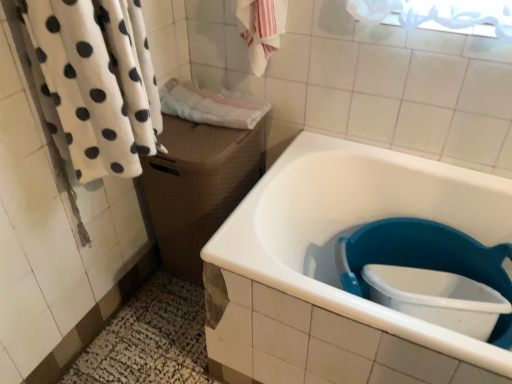
Where is `brown woven box at center`? Image resolution: width=512 pixels, height=384 pixels. brown woven box at center is located at coordinates (198, 186).

What do you see at coordinates (261, 29) in the screenshot? I see `white striped fabric at upper center, acting as the 2th bath towel starting from the back` at bounding box center [261, 29].

Image resolution: width=512 pixels, height=384 pixels. What do you see at coordinates (96, 83) in the screenshot?
I see `white fluffy towel at left, arranged as the 3th bath towel when viewed from the back` at bounding box center [96, 83].

Identify the location of pink terry cloth towel at center, marked as the first bath towel in a back-to-front arrangement. The width and height of the screenshot is (512, 384). (211, 105).

Find the location of `brown woven box at center`. brown woven box at center is located at coordinates (198, 186).

Choose the correct answer: Is brown woven box at center inside white striped fabric at upper center, acting as the 2th bath towel starting from the back, or outside it?

The correct answer is: outside.

Is point (199, 186) closer to viewer compared to point (272, 17)?

That is False.

Is brown woven box at center far from white striped fabric at upper center, acting as the 2th bath towel starting from the back?

No.

From the picture: From the image's perspective, between brown woven box at center and white striped fabric at upper center, acting as the 2th bath towel starting from the back, who is located below?

brown woven box at center is shown below in the image.

Between white fluffy towel at left, which appears as the 1th bath towel when viewed from the front, and pink terry cloth towel at center, marked as the first bath towel in a back-to-front arrangement, which one has smaller size?

pink terry cloth towel at center, marked as the first bath towel in a back-to-front arrangement.

Would you say white fluffy towel at left, which appears as the 1th bath towel when viewed from the front, is inside or outside pink terry cloth towel at center, marked as the first bath towel in a back-to-front arrangement?

white fluffy towel at left, which appears as the 1th bath towel when viewed from the front, lies outside pink terry cloth towel at center, marked as the first bath towel in a back-to-front arrangement.

Based on the photo, measure the distance from white fluffy towel at left, arranged as the 3th bath towel when viewed from the back, to pink terry cloth towel at center, the third bath towel in the front-to-back sequence.

15.48 inches.

Is white fluffy towel at left, arranged as the 3th bath towel when viewed from the back, wider or thinner than pink terry cloth towel at center, the third bath towel in the front-to-back sequence?

Considering their sizes, white fluffy towel at left, arranged as the 3th bath towel when viewed from the back, looks slimmer than pink terry cloth towel at center, the third bath towel in the front-to-back sequence.

From the image's perspective, is white fluffy towel at left, arranged as the 3th bath towel when viewed from the back, located above or below white glossy bathtub at lower right?

white fluffy towel at left, arranged as the 3th bath towel when viewed from the back, is situated higher than white glossy bathtub at lower right in the image.

Is white fluffy towel at left, which appears as the 1th bath towel when viewed from the front, positioned with its back to white glossy bathtub at lower right?

white fluffy towel at left, which appears as the 1th bath towel when viewed from the front, is not turned away from white glossy bathtub at lower right.

Is white fluffy towel at left, arranged as the 3th bath towel when viewed from the back, taller than white glossy bathtub at lower right?

Yes, white fluffy towel at left, arranged as the 3th bath towel when viewed from the back, is taller than white glossy bathtub at lower right.

From a real-world perspective, does white fluffy towel at left, which appears as the 1th bath towel when viewed from the front, sit lower than white glossy bathtub at lower right?

No, from a real-world perspective, white fluffy towel at left, which appears as the 1th bath towel when viewed from the front, is not below white glossy bathtub at lower right.

Which object is positioned more to the left, white glossy bathtub at lower right or white fluffy towel at left, arranged as the 3th bath towel when viewed from the back?

From the viewer's perspective, white fluffy towel at left, arranged as the 3th bath towel when viewed from the back, appears more on the left side.

Is white glossy bathtub at lower right inside the boundaries of white fluffy towel at left, which appears as the 1th bath towel when viewed from the front, or outside?

white glossy bathtub at lower right exists outside the volume of white fluffy towel at left, which appears as the 1th bath towel when viewed from the front.

Is white glossy bathtub at lower right further to camera compared to white fluffy towel at left, which appears as the 1th bath towel when viewed from the front?

Yes, white glossy bathtub at lower right is behind white fluffy towel at left, which appears as the 1th bath towel when viewed from the front.

Can you confirm if white glossy bathtub at lower right is bigger than white fluffy towel at left, arranged as the 3th bath towel when viewed from the back?

Yes.

From the image's perspective, does white fluffy towel at left, which appears as the 1th bath towel when viewed from the front, appear lower than brown woven box at center?

No, from the image's perspective, white fluffy towel at left, which appears as the 1th bath towel when viewed from the front, is not beneath brown woven box at center.

This screenshot has width=512, height=384. I want to click on the 1st bath towel above the brown woven box at center (from the image's perspective), so click(96, 83).

Visually, is white fluffy towel at left, arranged as the 3th bath towel when viewed from the back, positioned to the left or to the right of brown woven box at center?

Clearly, white fluffy towel at left, arranged as the 3th bath towel when viewed from the back, is on the left of brown woven box at center in the image.

Does white glossy bathtub at lower right turn towards white striped fabric at upper center, which is counted as the 2th bath towel, starting from the front?

No, white glossy bathtub at lower right does not turn towards white striped fabric at upper center, which is counted as the 2th bath towel, starting from the front.

Where is `bathtub that is on the right side of white striped fabric at upper center, which is counted as the 2th bath towel, starting from the front`? bathtub that is on the right side of white striped fabric at upper center, which is counted as the 2th bath towel, starting from the front is located at coordinates (336, 270).

Which object is positioned more to the left, white glossy bathtub at lower right or white striped fabric at upper center, which is counted as the 2th bath towel, starting from the front?

Positioned to the left is white striped fabric at upper center, which is counted as the 2th bath towel, starting from the front.

Is white glossy bathtub at lower right directly adjacent to white striped fabric at upper center, which is counted as the 2th bath towel, starting from the front?

No.

Between white striped fabric at upper center, acting as the 2th bath towel starting from the back, and pink terry cloth towel at center, the third bath towel in the front-to-back sequence, which one has smaller width?

With smaller width is white striped fabric at upper center, acting as the 2th bath towel starting from the back.

From the picture: From a real-world perspective, is white striped fabric at upper center, which is counted as the 2th bath towel, starting from the front, physically located above or below pink terry cloth towel at center, the third bath towel in the front-to-back sequence?

In terms of real-world spatial position, white striped fabric at upper center, which is counted as the 2th bath towel, starting from the front, is above pink terry cloth towel at center, the third bath towel in the front-to-back sequence.

Between white striped fabric at upper center, which is counted as the 2th bath towel, starting from the front, and pink terry cloth towel at center, marked as the first bath towel in a back-to-front arrangement, which one has more height?

white striped fabric at upper center, which is counted as the 2th bath towel, starting from the front, is taller.

Is white striped fabric at upper center, acting as the 2th bath towel starting from the back, located outside pink terry cloth towel at center, marked as the first bath towel in a back-to-front arrangement?

That's correct, white striped fabric at upper center, acting as the 2th bath towel starting from the back, is outside of pink terry cloth towel at center, marked as the first bath towel in a back-to-front arrangement.

Where is `box below the white striped fabric at upper center, acting as the 2th bath towel starting from the back (from the image's perspective)`? box below the white striped fabric at upper center, acting as the 2th bath towel starting from the back (from the image's perspective) is located at coordinates (198, 186).

Locate an element on the screen. The height and width of the screenshot is (384, 512). bath towel lying on the left of pink terry cloth towel at center, marked as the first bath towel in a back-to-front arrangement is located at coordinates (96, 83).

Considering their positions, is pink terry cloth towel at center, marked as the first bath towel in a back-to-front arrangement, positioned closer to white glossy bathtub at lower right than brown woven box at center?

brown woven box at center is closer to white glossy bathtub at lower right.

Which object lies further to the anchor point white glossy bathtub at lower right, white striped fabric at upper center, acting as the 2th bath towel starting from the back, or brown woven box at center?

white striped fabric at upper center, acting as the 2th bath towel starting from the back.

Looking at the image, which one is located closer to white fluffy towel at left, which appears as the 1th bath towel when viewed from the front, pink terry cloth towel at center, the third bath towel in the front-to-back sequence, or brown woven box at center?

brown woven box at center.

From the image, which object appears to be farther from brown woven box at center, pink terry cloth towel at center, marked as the first bath towel in a back-to-front arrangement, or white glossy bathtub at lower right?

Based on the image, white glossy bathtub at lower right appears to be further to brown woven box at center.

When comparing their distances from pink terry cloth towel at center, the third bath towel in the front-to-back sequence, does white glossy bathtub at lower right or brown woven box at center seem further?

Based on the image, white glossy bathtub at lower right appears to be further to pink terry cloth towel at center, the third bath towel in the front-to-back sequence.

From the image, which object appears to be farther from white striped fabric at upper center, which is counted as the 2th bath towel, starting from the front, white fluffy towel at left, which appears as the 1th bath towel when viewed from the front, or pink terry cloth towel at center, the third bath towel in the front-to-back sequence?

white fluffy towel at left, which appears as the 1th bath towel when viewed from the front, lies further to white striped fabric at upper center, which is counted as the 2th bath towel, starting from the front, than the other object.

Based on their spatial positions, is white fluffy towel at left, which appears as the 1th bath towel when viewed from the front, or white glossy bathtub at lower right further from pink terry cloth towel at center, the third bath towel in the front-to-back sequence?

white glossy bathtub at lower right.

Based on the photo, looking at the image, which one is located closer to white striped fabric at upper center, acting as the 2th bath towel starting from the back, white fluffy towel at left, arranged as the 3th bath towel when viewed from the back, or white glossy bathtub at lower right?

Among the two, white fluffy towel at left, arranged as the 3th bath towel when viewed from the back, is located nearer to white striped fabric at upper center, acting as the 2th bath towel starting from the back.

The image size is (512, 384). Identify the location of box located between white fluffy towel at left, which appears as the 1th bath towel when viewed from the front, and pink terry cloth towel at center, marked as the first bath towel in a back-to-front arrangement, in the depth direction. (198, 186).

Identify the location of box situated between white fluffy towel at left, arranged as the 3th bath towel when viewed from the back, and white glossy bathtub at lower right from left to right. (198, 186).

Where is `bath towel between white fluffy towel at left, which appears as the 1th bath towel when viewed from the front, and pink terry cloth towel at center, marked as the first bath towel in a back-to-front arrangement, in the front-back direction`? This screenshot has height=384, width=512. bath towel between white fluffy towel at left, which appears as the 1th bath towel when viewed from the front, and pink terry cloth towel at center, marked as the first bath towel in a back-to-front arrangement, in the front-back direction is located at coordinates (261, 29).

This screenshot has width=512, height=384. In order to click on box between white striped fabric at upper center, acting as the 2th bath towel starting from the back, and white glossy bathtub at lower right, in the vertical direction in this screenshot , I will do `click(198, 186)`.